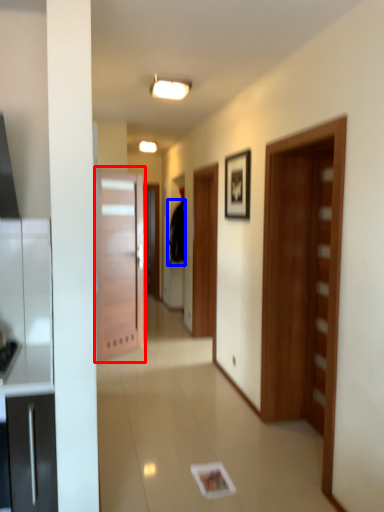
Question: Which object is closer to the camera taking this photo, door (highlighted by a red box) or robe (highlighted by a blue box)?

Choices:
 (A) door
 (B) robe

Answer: (A)